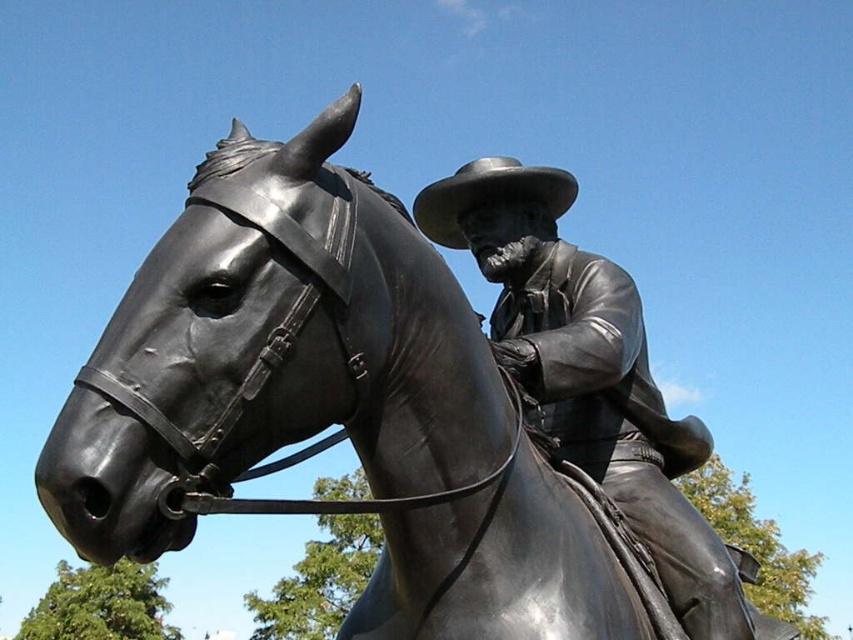
Is polished bronze cowboy at center shorter than matte brown cowboy hat at center?

No.

Who is more forward, (523, 308) or (425, 218)?

Point (523, 308) is more forward.

At what (x,y) coordinates should I click in order to perform the action: click on polished bronze cowboy at center. Please return your answer as a coordinate pair (x, y). Image resolution: width=853 pixels, height=640 pixels. Looking at the image, I should click on (589, 371).